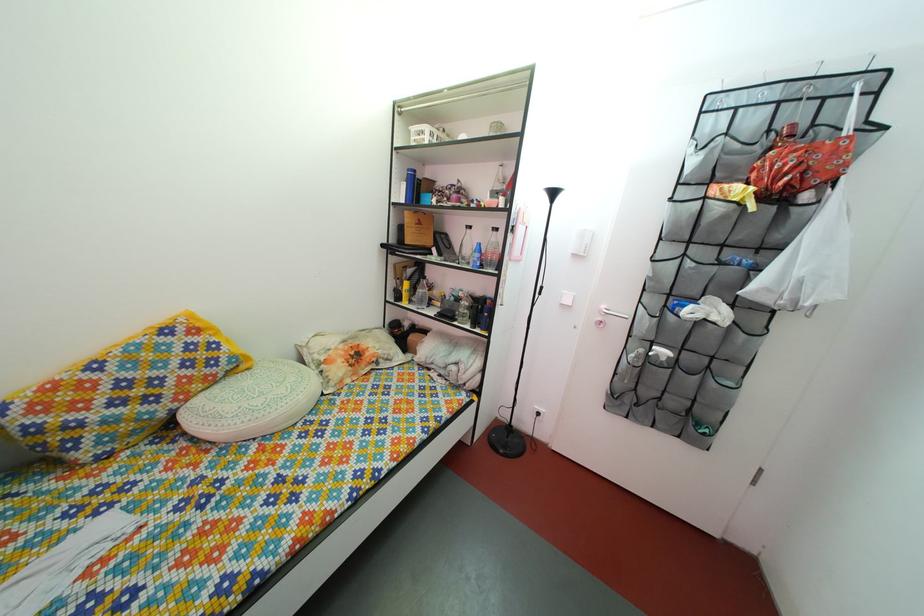
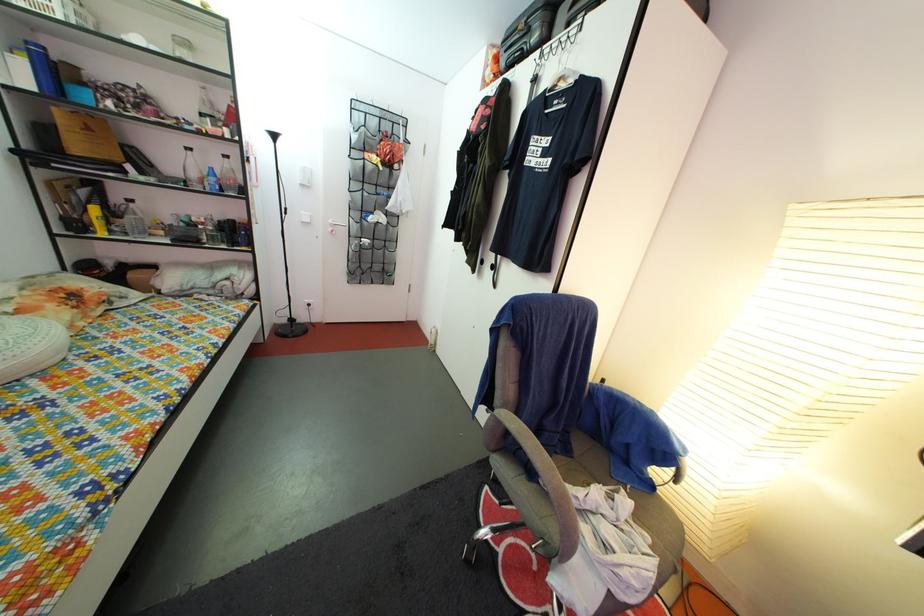
The point at (258, 426) is marked in the first image. Where is the corresponding point in the second image?

(9, 366)